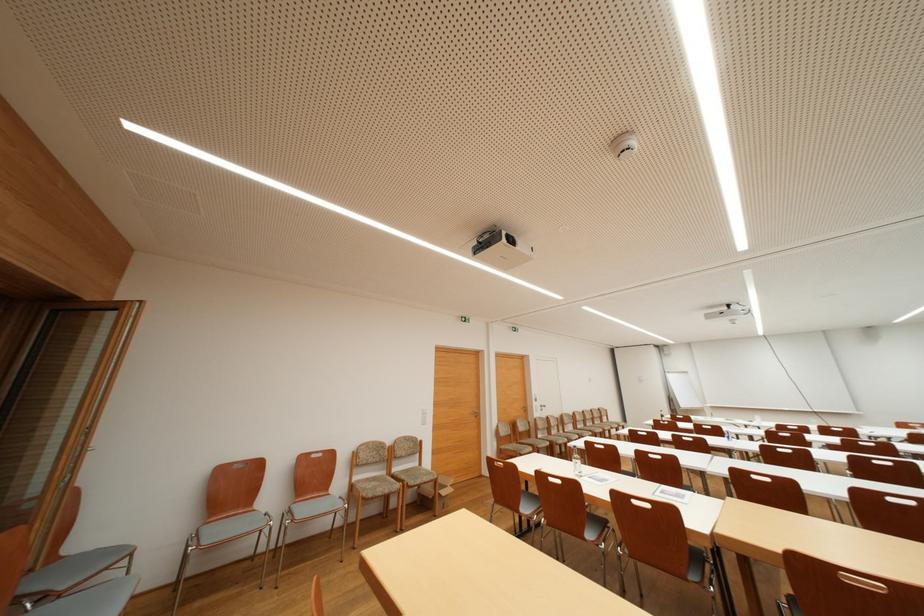
At what (x,y) coordinates should I click in order to perform the action: click on chair backrest handle. Please return your answer as a coordinate pair (x, y). Looking at the image, I should click on [228, 514].